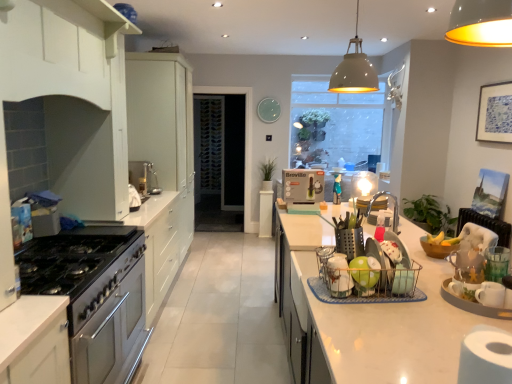
At what (x,y) coordinates should I click in order to perform the action: click on empty space that is ontop of metallic wire basket at right (from a real-world perspective). Please return your answer as a coordinate pair (x, y). The image size is (512, 384). Looking at the image, I should click on (370, 249).